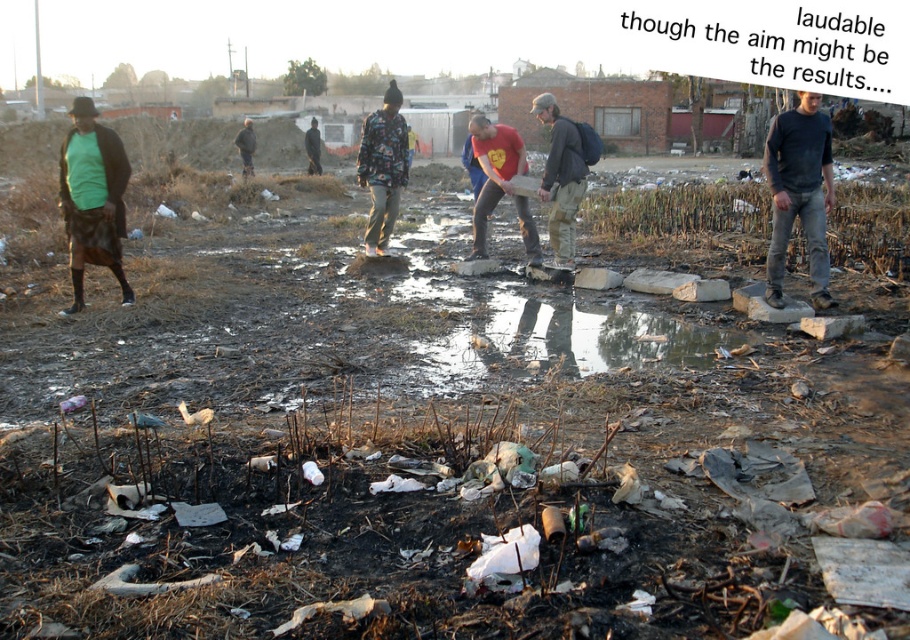
Looking at this image, you are a delivery person needing to cross the area to reach a package on the other side. The glossy concrete puddle at center and the green matte shirt at left are in your path. Which object should you avoid stepping on to prevent slipping?

You should avoid stepping on the glossy concrete puddle at center because it is in front of the green matte shirt at left and likely slippery due to its glossy surface.